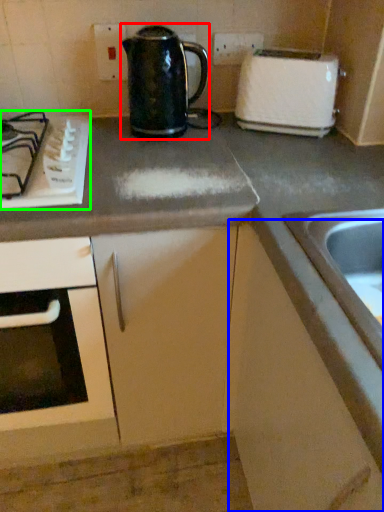
Question: Which object is positioned farthest from kettle (highlighted by a red box)? Select from cabinetry (highlighted by a blue box) and gas stove (highlighted by a green box).

Choices:
 (A) cabinetry
 (B) gas stove

Answer: (A)